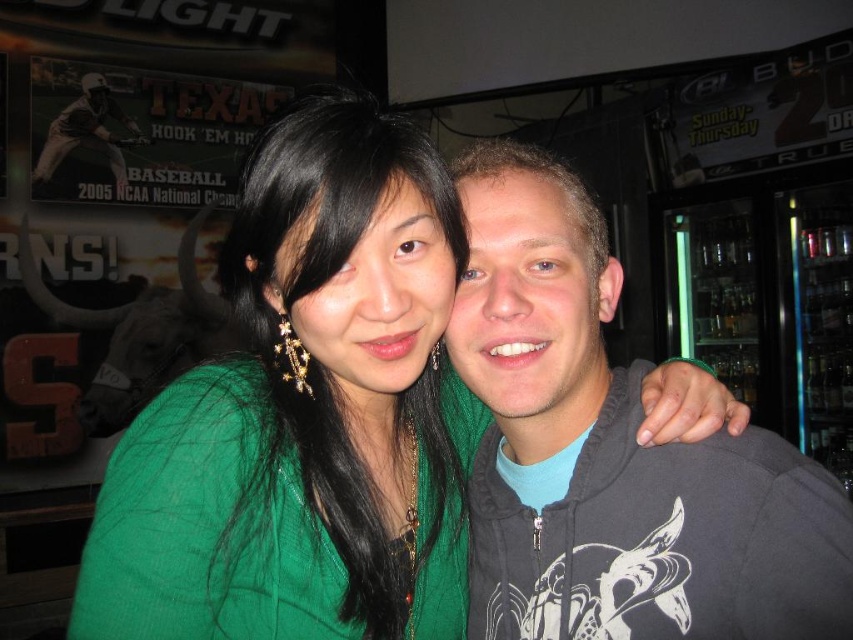
Consider the image. Can you confirm if green fabric at center is positioned below dark gray hoodie at right?

Actually, green fabric at center is above dark gray hoodie at right.

Is point (396, 332) farther from viewer compared to point (791, 540)?

Yes, point (396, 332) is behind point (791, 540).

This screenshot has height=640, width=853. I want to click on green fabric at center, so click(x=305, y=413).